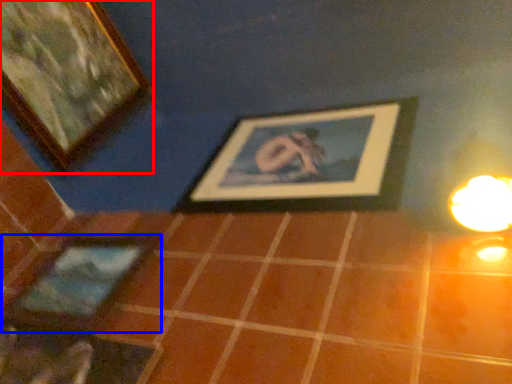
Question: Which point is further to the camera, picture frame (highlighted by a red box) or picture frame (highlighted by a blue box)?

Choices:
 (A) picture frame
 (B) picture frame

Answer: (A)